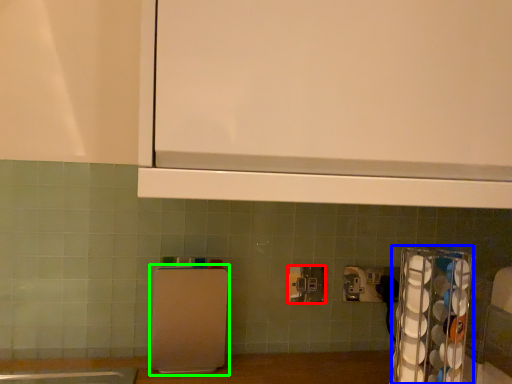
Question: Considering the real-world distances, which object is farthest from power plugs and sockets (highlighted by a red box)? appliance (highlighted by a blue box) or appliance (highlighted by a green box)?

Choices:
 (A) appliance
 (B) appliance

Answer: (A)